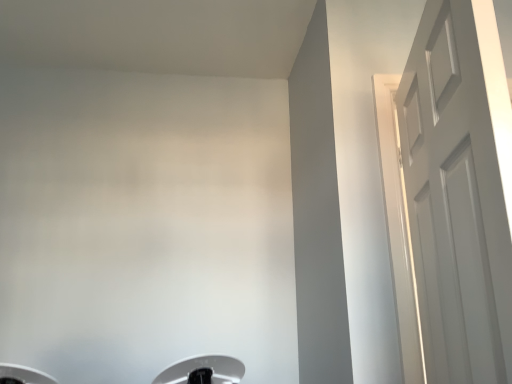
Find the location of `white matte door at right`. white matte door at right is located at coordinates (459, 190).

What do you see at coordinates (459, 190) in the screenshot? I see `white matte door at right` at bounding box center [459, 190].

Find the location of a particular element. white matte door at right is located at coordinates (459, 190).